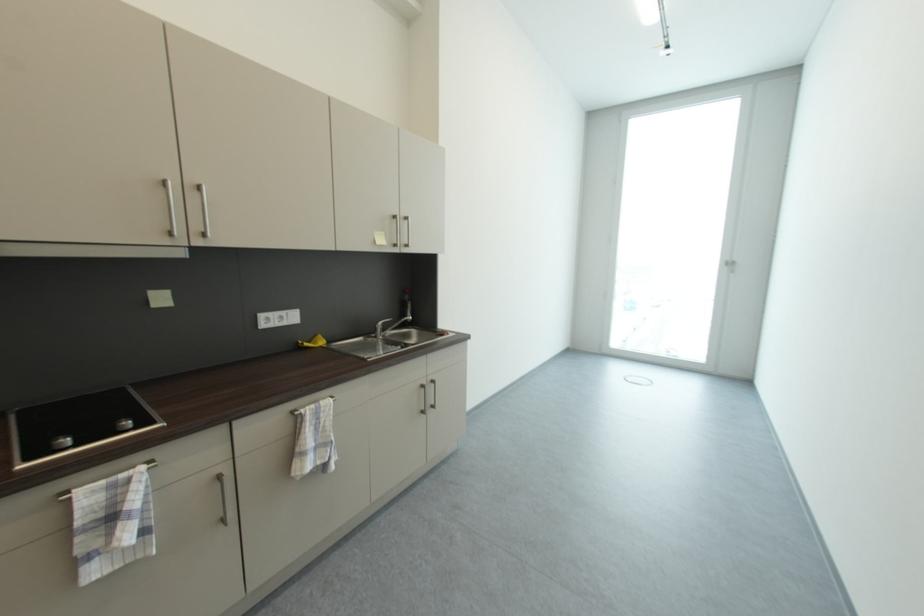
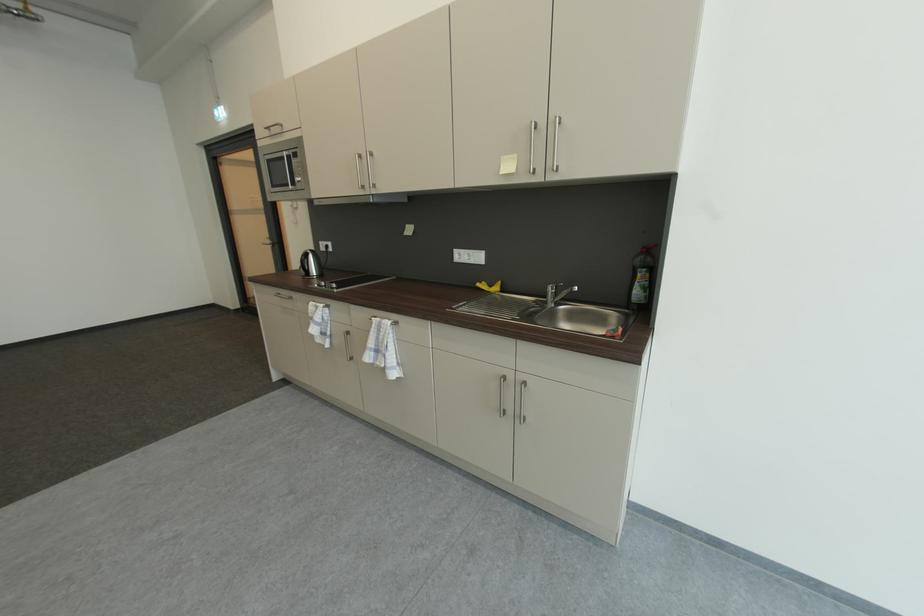
Locate, in the second image, the point that corresponds to point (305, 344) in the first image.

(487, 284)